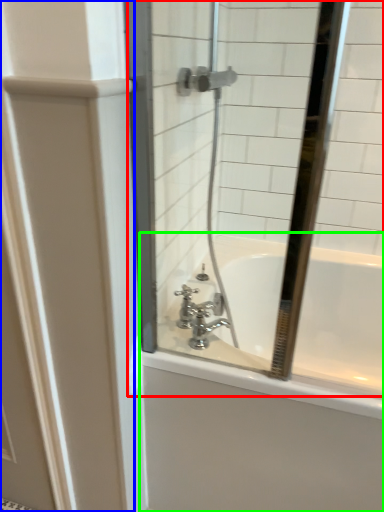
Question: Which object is the closest to the mirror (highlighted by a red box)? Choose among these: screen door (highlighted by a blue box) or bathtub (highlighted by a green box).

Choices:
 (A) screen door
 (B) bathtub

Answer: (B)